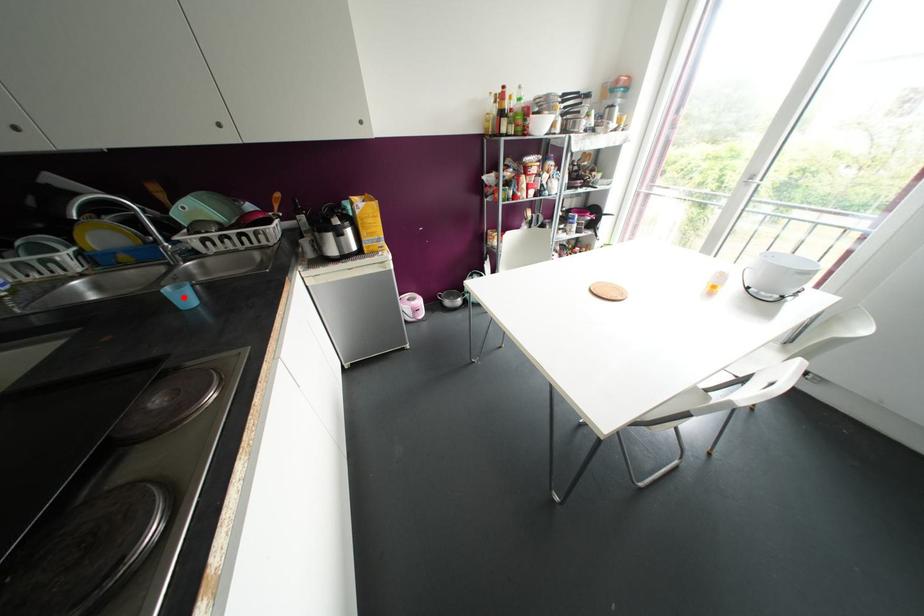
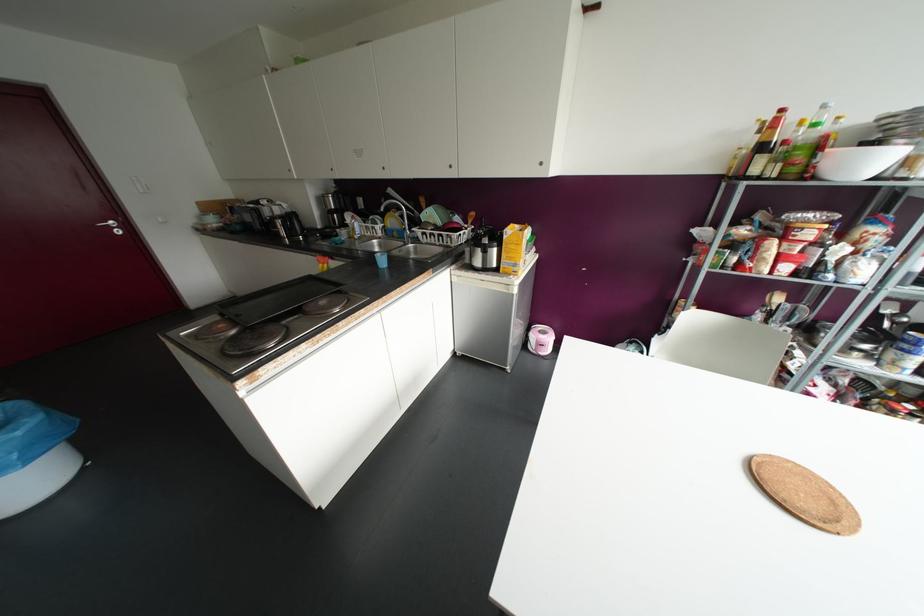
Question: I am providing you with two images of the same scene from different viewpoints. Given a red point in image1, look at the same physical point in image2. Is it:

Choices:
 (A) Closer to the viewpoint
 (B) Farther from the viewpoint

Answer: (A)